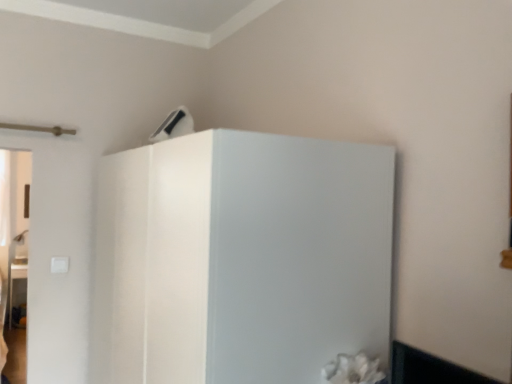
Question: Is white plastic air conditioner at upper center oriented away from white glossy refrigerator at upper center?

Choices:
 (A) no
 (B) yes

Answer: (A)

Question: Is white plastic air conditioner at upper center wider than white glossy refrigerator at upper center?

Choices:
 (A) no
 (B) yes

Answer: (A)

Question: From a real-world perspective, is white plastic air conditioner at upper center positioned over white glossy refrigerator at upper center based on gravity?

Choices:
 (A) yes
 (B) no

Answer: (A)

Question: Does white plastic air conditioner at upper center appear on the left side of white glossy refrigerator at upper center?

Choices:
 (A) no
 (B) yes

Answer: (B)

Question: Is the depth of white plastic air conditioner at upper center less than that of white glossy refrigerator at upper center?

Choices:
 (A) no
 (B) yes

Answer: (A)

Question: Can you confirm if white plastic air conditioner at upper center is taller than white glossy refrigerator at upper center?

Choices:
 (A) yes
 (B) no

Answer: (B)

Question: Does white glossy refrigerator at upper center have a lesser width compared to white plastic air conditioner at upper center?

Choices:
 (A) yes
 (B) no

Answer: (B)

Question: Is white glossy refrigerator at upper center positioned behind white plastic air conditioner at upper center?

Choices:
 (A) no
 (B) yes

Answer: (A)

Question: Considering the relative positions of white glossy refrigerator at upper center and white plastic air conditioner at upper center in the image provided, is white glossy refrigerator at upper center to the right of white plastic air conditioner at upper center from the viewer's perspective?

Choices:
 (A) no
 (B) yes

Answer: (B)

Question: Considering the relative sizes of white glossy refrigerator at upper center and white plastic air conditioner at upper center in the image provided, is white glossy refrigerator at upper center bigger than white plastic air conditioner at upper center?

Choices:
 (A) yes
 (B) no

Answer: (A)

Question: Does white glossy refrigerator at upper center appear on the left side of white plastic air conditioner at upper center?

Choices:
 (A) no
 (B) yes

Answer: (A)

Question: From the image's perspective, is white glossy refrigerator at upper center on white plastic air conditioner at upper center?

Choices:
 (A) yes
 (B) no

Answer: (B)

Question: Do you think white glossy refrigerator at upper center is within white plastic air conditioner at upper center, or outside of it?

Choices:
 (A) inside
 (B) outside

Answer: (B)